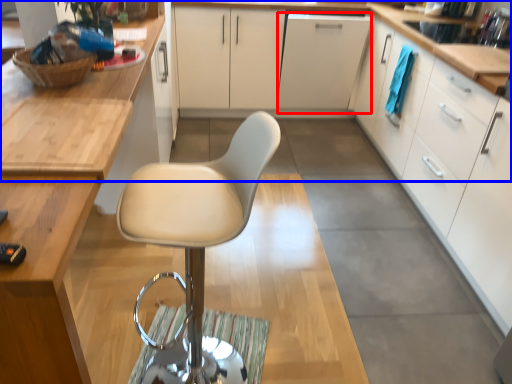
Question: Which object appears closest to the camera in this image, file cabinet (highlighted by a red box) or countertop (highlighted by a blue box)?

Choices:
 (A) file cabinet
 (B) countertop

Answer: (B)